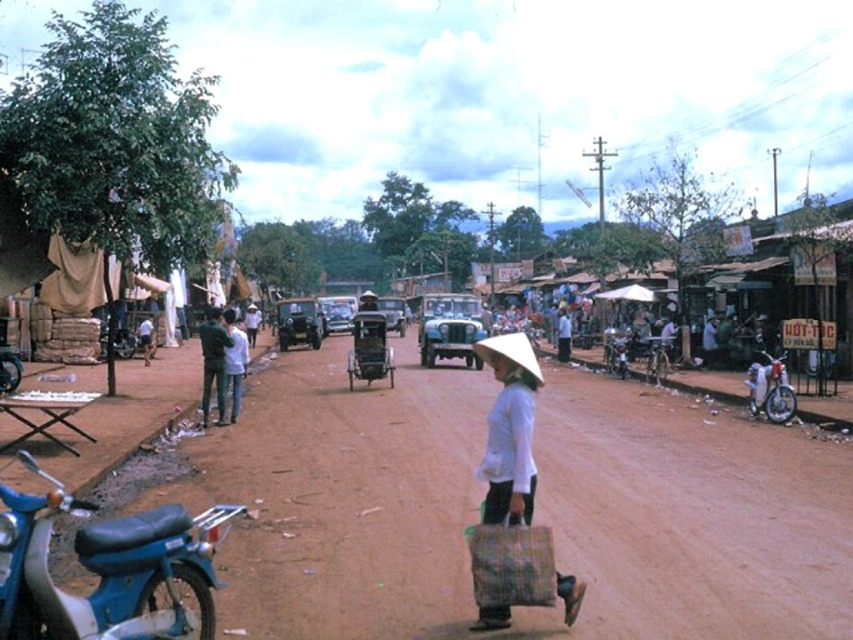
Question: Which of the following is the farthest from the observer?

Choices:
 (A) (529, 342)
 (B) (757, 369)
 (C) (241, 380)

Answer: (B)

Question: Which is farther from the white cotton shirt at center?

Choices:
 (A) white woven bag at center
 (B) white glossy motorcycle at right

Answer: (B)

Question: Which object is positioned farthest from the wooden cart at center?

Choices:
 (A) white woven bag at center
 (B) white fabric hat at center
 (C) light blue jeans at center
 (D) white glossy motorcycle at right

Answer: (B)

Question: Can you confirm if white cotton shirt at center is bigger than light blue jeans at center?

Choices:
 (A) yes
 (B) no

Answer: (A)

Question: Can you confirm if white woven bag at center is positioned to the right of wooden cart at center?

Choices:
 (A) yes
 (B) no

Answer: (A)

Question: Can you confirm if white fabric hat at center is thinner than light blue jeans at center?

Choices:
 (A) no
 (B) yes

Answer: (B)